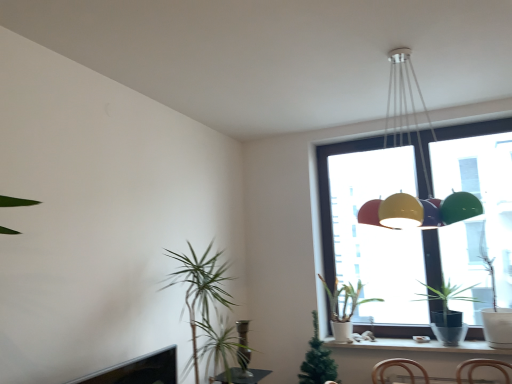
The height and width of the screenshot is (384, 512). In order to click on green glossy houseplant at window, the 1th houseplant viewed from the right in this screenshot , I will do `click(447, 313)`.

The width and height of the screenshot is (512, 384). I want to click on white ceramic window sill at lower right, so click(419, 346).

What is the approximate width of metallic pendant light at upper center?

The width of metallic pendant light at upper center is 60.41 centimeters.

In order to face white matte pot at window, the 2th houseplant from the left, should I rotate leftwards or rightwards?

Turn right approximately 12.658 degrees to face it.

The image size is (512, 384). In order to click on green leafy plant at left, marked as the first houseplant in a left-to-right arrangement in this screenshot , I will do `click(200, 288)`.

Is transparent glass window at upper right with green leafy plant at left, marked as the first houseplant in a left-to-right arrangement?

transparent glass window at upper right and green leafy plant at left, marked as the first houseplant in a left-to-right arrangement, are clearly separated.

Based on the photo, does transparent glass window at upper right appear on the right side of green leafy plant at left, marked as the first houseplant in a left-to-right arrangement?

Indeed, transparent glass window at upper right is positioned on the right side of green leafy plant at left, marked as the first houseplant in a left-to-right arrangement.

How many degrees apart are the facing directions of transparent glass window at upper right and green leafy plant at left, marked as the first houseplant in a left-to-right arrangement?

transparent glass window at upper right and green leafy plant at left, marked as the first houseplant in a left-to-right arrangement, are facing 90.2 degrees away from each other.

Does transparent glass window at upper right have a larger size compared to green leafy plant at left, marked as the first houseplant in a left-to-right arrangement?

Incorrect, transparent glass window at upper right is not larger than green leafy plant at left, marked as the first houseplant in a left-to-right arrangement.

Is transparent glass window at upper right aimed at green glossy houseplant at window, the 1th houseplant viewed from the right?

Yes.

Looking at this image, considering the relative sizes of transparent glass window at upper right and green glossy houseplant at window, which ranks as the 3th houseplant in left-to-right order, in the image provided, is transparent glass window at upper right taller than green glossy houseplant at window, which ranks as the 3th houseplant in left-to-right order,?

Correct, transparent glass window at upper right is much taller as green glossy houseplant at window, which ranks as the 3th houseplant in left-to-right order.

Considering the sizes of transparent glass window at upper right and green glossy houseplant at window, the 1th houseplant viewed from the right, in the image, is transparent glass window at upper right wider or thinner than green glossy houseplant at window, the 1th houseplant viewed from the right,?

Clearly, transparent glass window at upper right has less width compared to green glossy houseplant at window, the 1th houseplant viewed from the right.

From the image's perspective, relative to green glossy houseplant at window, the 1th houseplant viewed from the right, is transparent glass window at upper right above or below?

From the image's perspective, transparent glass window at upper right appears above green glossy houseplant at window, the 1th houseplant viewed from the right.

Is green leafy plant at left, marked as the first houseplant in a left-to-right arrangement, to the right of metallic pendant light at upper center from the viewer's perspective?

In fact, green leafy plant at left, marked as the first houseplant in a left-to-right arrangement, is to the left of metallic pendant light at upper center.

The width and height of the screenshot is (512, 384). Find the location of `lamp in front of the green leafy plant at left, arranged as the 3th houseplant when viewed from the right`. lamp in front of the green leafy plant at left, arranged as the 3th houseplant when viewed from the right is located at coordinates point(421,161).

Do you think green leafy plant at left, marked as the first houseplant in a left-to-right arrangement, is within metallic pendant light at upper center, or outside of it?

The correct answer is: outside.

Is point (184, 273) in front of point (383, 214)?

No.

Is white matte pot at window, the 2th houseplant from the left, with transparent glass window at upper right?

white matte pot at window, the 2th houseplant from the left, is not next to transparent glass window at upper right, and they're not touching.

Does point (351, 308) come behind point (415, 169)?

No, (351, 308) is closer to viewer.

From a real-world perspective, is white matte pot at window, the 2th houseplant from the left, physically located above or below transparent glass window at upper right?

white matte pot at window, the 2th houseplant from the left, is situated lower than transparent glass window at upper right in the real world.

Which object is closer to the camera, white matte pot at window, which is the second houseplant in right-to-left order, or transparent glass window at upper right?

transparent glass window at upper right is more forward.

Consider the image. Considering their positions, is white ceramic window sill at lower right located in front of or behind green leafy plant at left, marked as the first houseplant in a left-to-right arrangement?

Clearly, white ceramic window sill at lower right is behind green leafy plant at left, marked as the first houseplant in a left-to-right arrangement.

Does white ceramic window sill at lower right have a lesser width compared to green leafy plant at left, arranged as the 3th houseplant when viewed from the right?

Correct, the width of white ceramic window sill at lower right is less than that of green leafy plant at left, arranged as the 3th houseplant when viewed from the right.

Is the surface of white ceramic window sill at lower right in direct contact with green leafy plant at left, marked as the first houseplant in a left-to-right arrangement?

No, white ceramic window sill at lower right is not beside green leafy plant at left, marked as the first houseplant in a left-to-right arrangement.

Is green leafy plant at left, arranged as the 3th houseplant when viewed from the right, surrounded by white ceramic window sill at lower right?

No.

Is green leafy plant at left, marked as the first houseplant in a left-to-right arrangement, positioned in front of white matte pot at window, which is the second houseplant in right-to-left order?

Yes, green leafy plant at left, marked as the first houseplant in a left-to-right arrangement, is closer to the viewer.

Does green leafy plant at left, arranged as the 3th houseplant when viewed from the right, turn towards white matte pot at window, which is the second houseplant in right-to-left order?

No.

From a real-world perspective, is green leafy plant at left, arranged as the 3th houseplant when viewed from the right, physically below white matte pot at window, which is the second houseplant in right-to-left order?

No, from a real-world perspective, green leafy plant at left, arranged as the 3th houseplant when viewed from the right, is not below white matte pot at window, which is the second houseplant in right-to-left order.

Considering the relative sizes of green leafy plant at left, arranged as the 3th houseplant when viewed from the right, and white matte pot at window, the 2th houseplant from the left, in the image provided, is green leafy plant at left, arranged as the 3th houseplant when viewed from the right, taller than white matte pot at window, the 2th houseplant from the left,?

Yes.

I want to click on window above the white ceramic window sill at lower right (from the image's perspective), so click(340, 191).

Is transparent glass window at upper right facing towards white ceramic window sill at lower right?

Yes, transparent glass window at upper right is turned towards white ceramic window sill at lower right.

From a real-world perspective, is transparent glass window at upper right located beneath white ceramic window sill at lower right?

No, from a real-world perspective, transparent glass window at upper right is not under white ceramic window sill at lower right.

From the image's perspective, which houseplant is the 1st one below the transparent glass window at upper right? Please provide its 2D coordinates.

[(200, 288)]

I want to click on window above the green glossy houseplant at window, which ranks as the 3th houseplant in left-to-right order (from the image's perspective), so click(340, 191).

Estimate the real-world distances between objects in this image. Which object is closer to white matte pot at window, which is the second houseplant in right-to-left order, white ceramic window sill at lower right or green glossy houseplant at window, the 1th houseplant viewed from the right?

white ceramic window sill at lower right lies closer to white matte pot at window, which is the second houseplant in right-to-left order, than the other object.

Based on their spatial positions, is green leafy plant at left, arranged as the 3th houseplant when viewed from the right, or white matte pot at window, which is the second houseplant in right-to-left order, closer to white ceramic window sill at lower right?

Based on the image, white matte pot at window, which is the second houseplant in right-to-left order, appears to be nearer to white ceramic window sill at lower right.

Looking at the image, which one is located closer to green glossy houseplant at window, which ranks as the 3th houseplant in left-to-right order, transparent glass window at upper right or white matte pot at window, which is the second houseplant in right-to-left order?

transparent glass window at upper right is positioned closer to the anchor green glossy houseplant at window, which ranks as the 3th houseplant in left-to-right order.

Based on the photo, which object lies nearer to the anchor point metallic pendant light at upper center, white matte pot at window, the 2th houseplant from the left, or white ceramic window sill at lower right?

Among the two, white matte pot at window, the 2th houseplant from the left, is located nearer to metallic pendant light at upper center.

Estimate the real-world distances between objects in this image. Which object is closer to white ceramic window sill at lower right, metallic pendant light at upper center or transparent glass window at upper right?

transparent glass window at upper right is closer to white ceramic window sill at lower right.

Consider the image. Based on their spatial positions, is green leafy plant at left, arranged as the 3th houseplant when viewed from the right, or green glossy houseplant at window, which ranks as the 3th houseplant in left-to-right order, closer to metallic pendant light at upper center?

The object closer to metallic pendant light at upper center is green glossy houseplant at window, which ranks as the 3th houseplant in left-to-right order.

Considering their positions, is white matte pot at window, which is the second houseplant in right-to-left order, positioned further to green leafy plant at left, marked as the first houseplant in a left-to-right arrangement, than metallic pendant light at upper center?

The object further to green leafy plant at left, marked as the first houseplant in a left-to-right arrangement, is metallic pendant light at upper center.

When comparing their distances from metallic pendant light at upper center, does green glossy houseplant at window, which ranks as the 3th houseplant in left-to-right order, or green leafy plant at left, marked as the first houseplant in a left-to-right arrangement, seem closer?

green glossy houseplant at window, which ranks as the 3th houseplant in left-to-right order, is positioned closer to the anchor metallic pendant light at upper center.

Locate an element on the screen. window sill between white matte pot at window, the 2th houseplant from the left, and green glossy houseplant at window, the 1th houseplant viewed from the right, from left to right is located at coordinates (419, 346).

Identify the location of houseplant between green leafy plant at left, marked as the first houseplant in a left-to-right arrangement, and transparent glass window at upper right. (344, 307).

You are a GUI agent. You are given a task and a screenshot of the screen. Output one action in this format:
    pyautogui.click(x=<x>, y=<y>)
    Task: Click on the houseplant situated between green leafy plant at left, marked as the first houseplant in a left-to-right arrangement, and green glossy houseplant at window, which ranks as the 3th houseplant in left-to-right order, from left to right
    
    Given the screenshot: What is the action you would take?
    pyautogui.click(x=344, y=307)

Find the location of a particular element. window between green leafy plant at left, marked as the first houseplant in a left-to-right arrangement, and green glossy houseplant at window, the 1th houseplant viewed from the right is located at coordinates (340, 191).